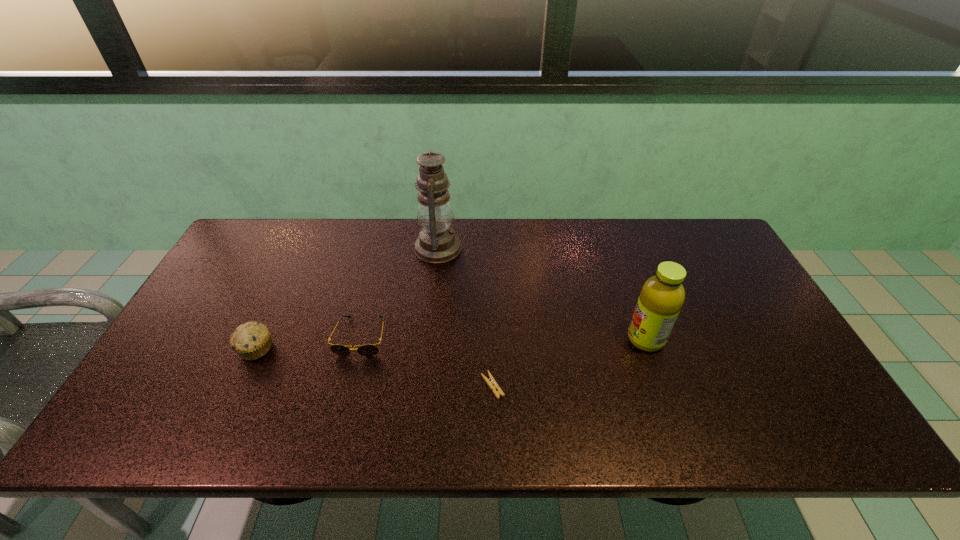
Image resolution: width=960 pixels, height=540 pixels. Identify the location of blank space at the left edge of the desktop. (187, 394).

In the image, there is a desktop. Find the location of `vacant space at the right edge`. vacant space at the right edge is located at coordinates (795, 396).

In the image, there is a desktop. Find the location of `free space at the far right corner`. free space at the far right corner is located at coordinates (714, 259).

Locate an element on the screen. vacant space that's between the fourth tallest object and the clothespin is located at coordinates (426, 361).

Locate an element on the screen. Image resolution: width=960 pixels, height=540 pixels. empty space between the second object from left to right and the shortest object is located at coordinates (426, 361).

The image size is (960, 540). What are the coordinates of `vacant area that lies between the rightmost object and the nearest object` in the screenshot? It's located at 569,362.

Locate an element on the screen. The image size is (960, 540). vacant region between the third shortest object and the farthest object is located at coordinates (347, 299).

This screenshot has height=540, width=960. Find the location of `free area in between the clothespin and the fourth shortest object`. free area in between the clothespin and the fourth shortest object is located at coordinates (569, 362).

What are the coordinates of `free spot between the tallest object and the leftmost object` in the screenshot? It's located at (347, 299).

Identify the location of free space between the leftmost object and the fourth object from left to right. The height and width of the screenshot is (540, 960). (374, 367).